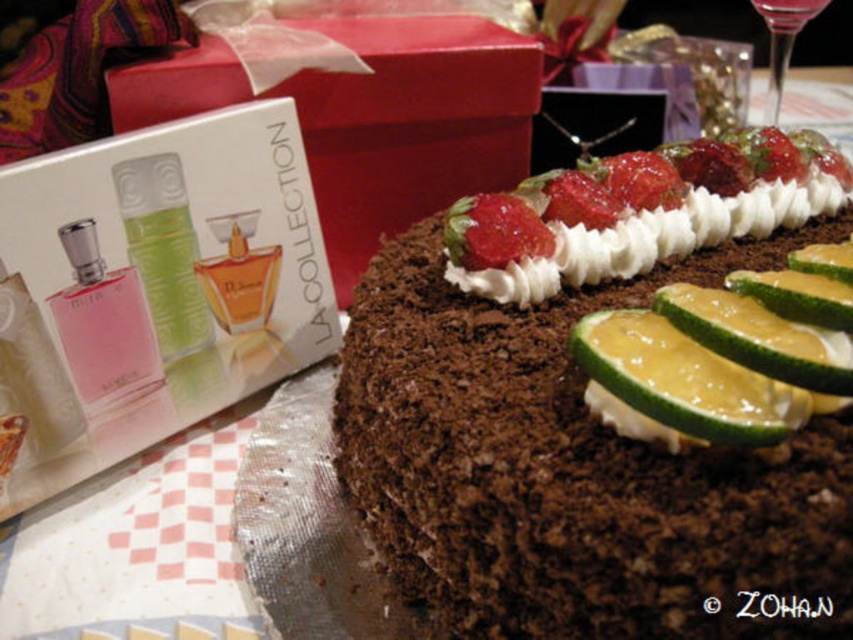
Which of these two, yellow glazed lemon at right or yellow glossy lemon at center, stands shorter?

Standing shorter between the two is yellow glossy lemon at center.

Does yellow glazed lemon at right lie behind yellow glossy lemon at center?

No, it is in front of yellow glossy lemon at center.

Who is more distant from viewer, (735, 348) or (817, 260)?

→ Point (817, 260)

Identify the location of yellow glazed lemon at right. The width and height of the screenshot is (853, 640). point(759,337).

In order to click on yellow smooth lemon at center in this screenshot , I will do `click(677, 385)`.

Who is positioned more to the left, yellow smooth lemon at center or whipped cream at center?

yellow smooth lemon at center

The width and height of the screenshot is (853, 640). I want to click on yellow smooth lemon at center, so click(x=677, y=385).

Find the location of a particular element. This screenshot has width=853, height=640. yellow smooth lemon at center is located at coordinates tap(677, 385).

Is point (643, 400) closer to camera compared to point (781, 316)?

Yes, point (643, 400) is closer to viewer.

Between yellow smooth lemon at center and yellow glazed lemon at center, which one appears on the right side from the viewer's perspective?

From the viewer's perspective, yellow glazed lemon at center appears more on the right side.

In order to click on yellow smooth lemon at center in this screenshot , I will do `click(677, 385)`.